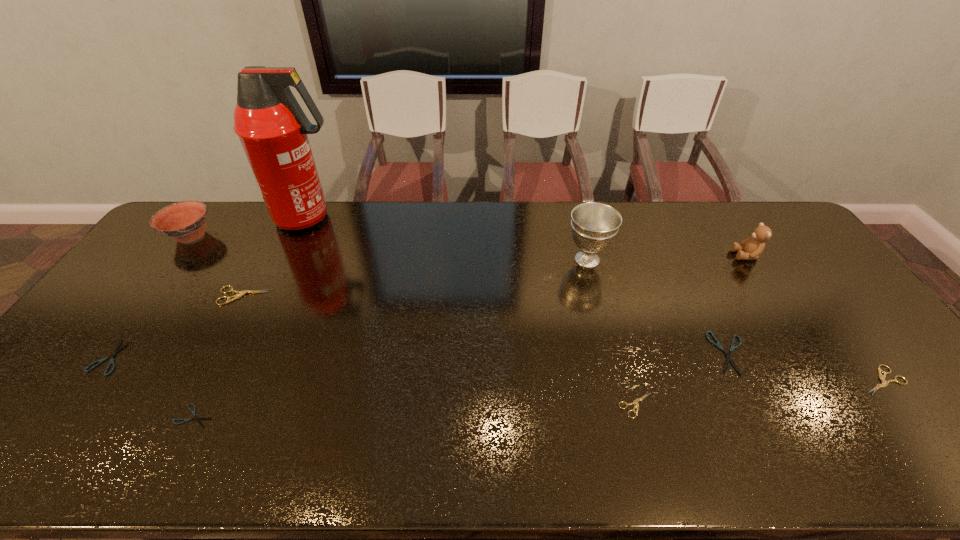
Identify the location of vacant region that satisfies the following two spatial constraints: 1. on the trigger side of the tallest object; 2. on the front side of the leftmost black shears. This screenshot has width=960, height=540. (245, 357).

This screenshot has width=960, height=540. What are the coordinates of `vacant region that satisfies the following two spatial constraints: 1. on the trigger side of the fire extinguisher; 2. on the right side of the eighth object from left to right` in the screenshot? It's located at (247, 353).

Where is `vacant space that satisfies the following two spatial constraints: 1. on the back side of the ninth shortest object; 2. on the right side of the leftmost black shears`? This screenshot has height=540, width=960. vacant space that satisfies the following two spatial constraints: 1. on the back side of the ninth shortest object; 2. on the right side of the leftmost black shears is located at coordinates (180, 260).

Identify the location of vacant position in the image that satisfies the following two spatial constraints: 1. on the trigger side of the second smallest beige shears; 2. on the right side of the fire extinguisher. The image size is (960, 540). (234, 380).

I want to click on vacant area that satisfies the following two spatial constraints: 1. on the face of the eighth shortest object; 2. on the left side of the rightmost object, so click(x=828, y=380).